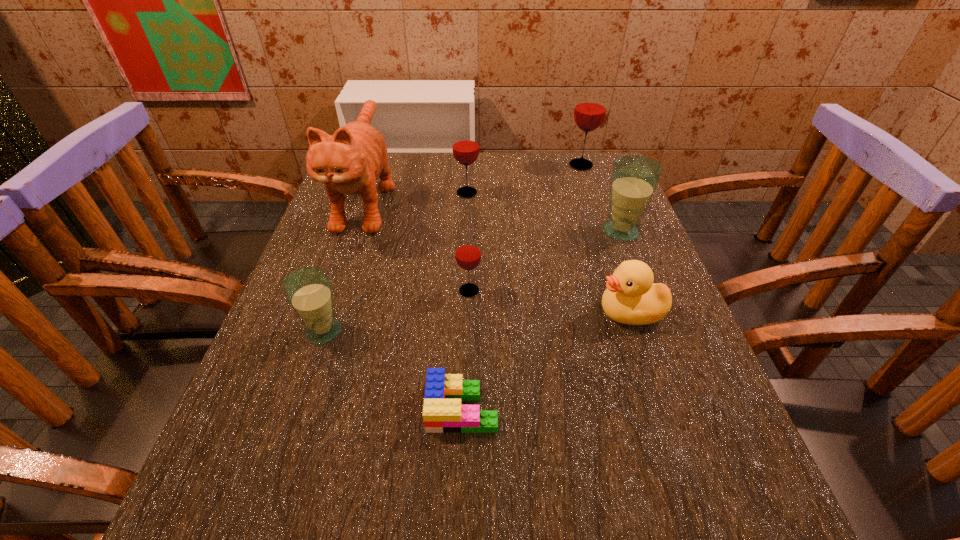
Locate an element on the screen. free spot that satisfies the following two spatial constraints: 1. on the front side of the tallest glass; 2. at the beak of the yellow duck is located at coordinates (630, 312).

The width and height of the screenshot is (960, 540). In order to click on vacant space that satisfies the following two spatial constraints: 1. on the face of the smallest red glass; 2. on the right side of the tallest object in this screenshot , I will do `click(334, 291)`.

Identify the location of free point that satisfies the following two spatial constraints: 1. on the face of the ginger cat; 2. on the left side of the bigger blue glass. This screenshot has height=540, width=960. (355, 231).

Identify the location of blank space that satisfies the following two spatial constraints: 1. on the back side of the biggest red glass; 2. on the left side of the second nearest glass. The width and height of the screenshot is (960, 540). (472, 165).

Locate an element on the screen. vacant position in the image that satisfies the following two spatial constraints: 1. on the face of the cat; 2. on the right side of the leftmost glass is located at coordinates (321, 331).